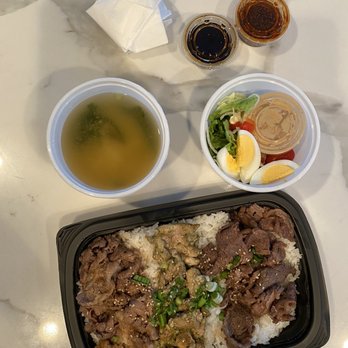
At what (x,y) coordinates should I click in order to perform the action: click on cup. Please return your answer as a coordinate pair (x, y). Looking at the image, I should click on (219, 60).